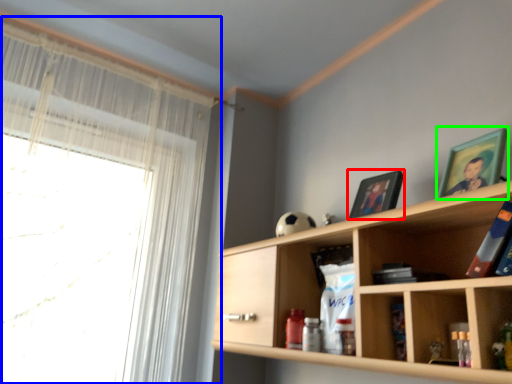
Question: Which is farther away from picture frame (highlighted by a red box)? window (highlighted by a blue box) or picture frame (highlighted by a green box)?

Choices:
 (A) window
 (B) picture frame

Answer: (A)